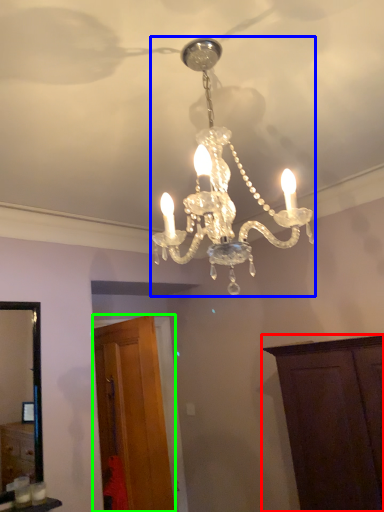
Question: Based on their relative distances, which object is nearer to cabinetry (highlighted by a red box)? Choose from lamp (highlighted by a blue box) and cabinetry (highlighted by a green box).

Choices:
 (A) lamp
 (B) cabinetry

Answer: (B)